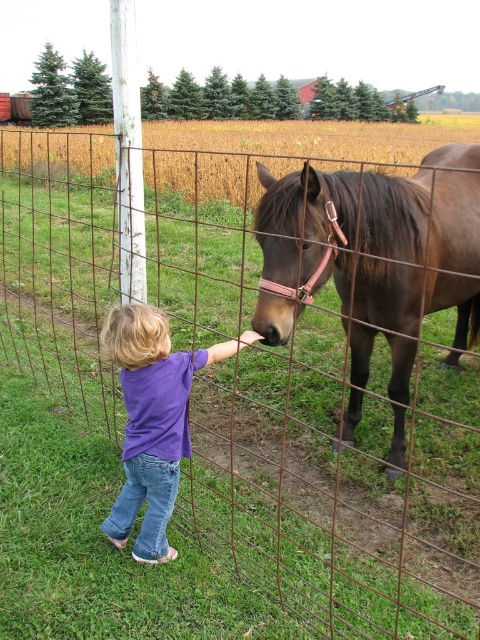
Question: Can you confirm if brown glossy horse at center is positioned to the left of purple cotton shirt at center?

Choices:
 (A) no
 (B) yes

Answer: (A)

Question: Is brown glossy horse at center wider than purple cotton shirt at center?

Choices:
 (A) no
 (B) yes

Answer: (B)

Question: Which object appears closest to the camera in this image?

Choices:
 (A) purple cotton shirt at center
 (B) brown glossy horse at center

Answer: (B)

Question: Which point is farther from the camera taking this photo?

Choices:
 (A) (315, 230)
 (B) (137, 400)

Answer: (A)

Question: Can you confirm if brown glossy horse at center is positioned above purple cotton shirt at center?

Choices:
 (A) yes
 (B) no

Answer: (A)